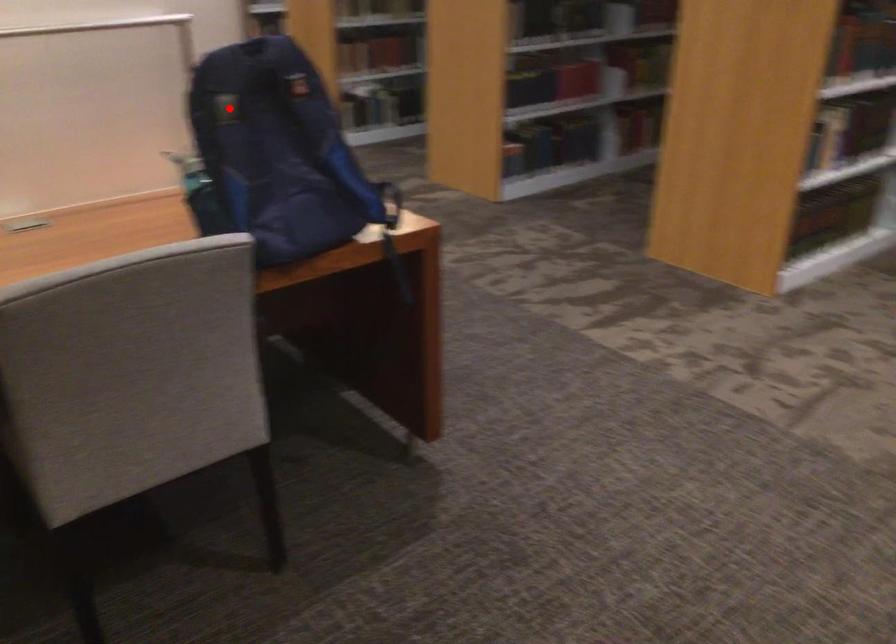
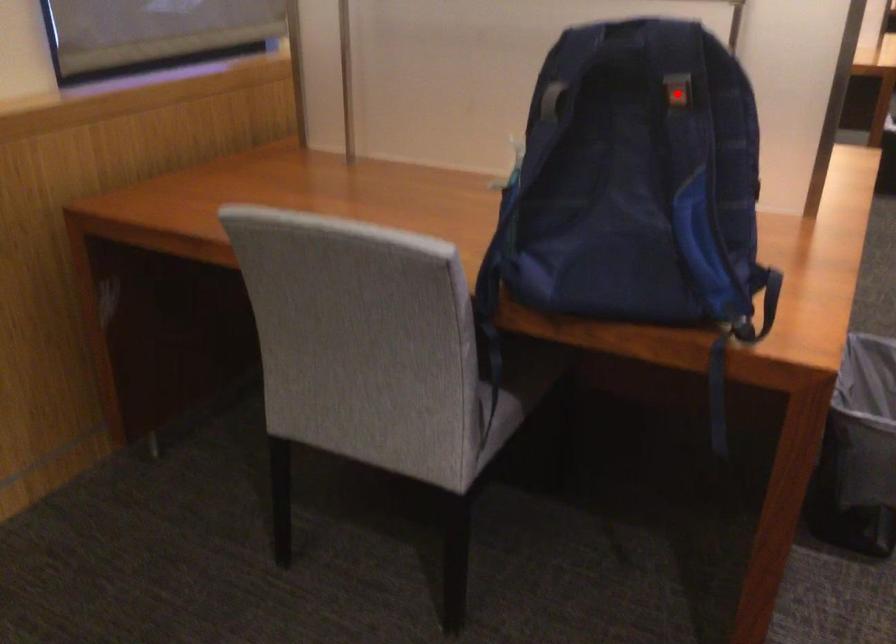
I am providing you with two images of the same scene from different viewpoints. A red point is marked on the first image and another point is marked on the second image. Do the highlighted points in image1 and image2 indicate the same real-world spot?

No